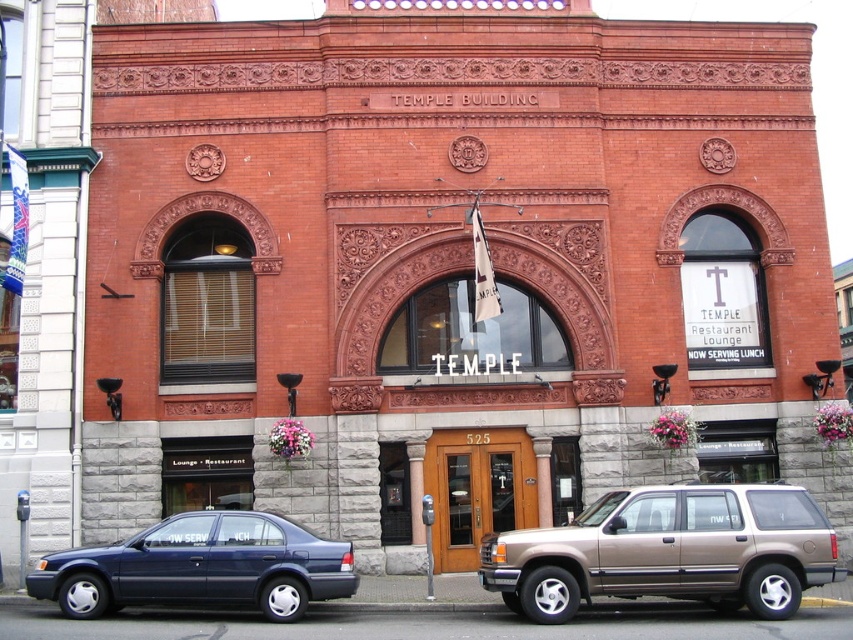
Question: Among these objects, which one is farthest from the camera?

Choices:
 (A) gold metallic suv at center
 (B) matte blue sedan at left

Answer: (B)

Question: Among these objects, which one is farthest from the camera?

Choices:
 (A) matte blue sedan at left
 (B) gold metallic suv at center

Answer: (A)

Question: Which of the following is the closest to the observer?

Choices:
 (A) matte blue sedan at left
 (B) gold metallic suv at center

Answer: (B)

Question: Does gold metallic suv at center appear under matte blue sedan at left?

Choices:
 (A) no
 (B) yes

Answer: (A)

Question: Is gold metallic suv at center to the right of matte blue sedan at left from the viewer's perspective?

Choices:
 (A) yes
 (B) no

Answer: (A)

Question: Does gold metallic suv at center have a greater width compared to matte blue sedan at left?

Choices:
 (A) no
 (B) yes

Answer: (A)